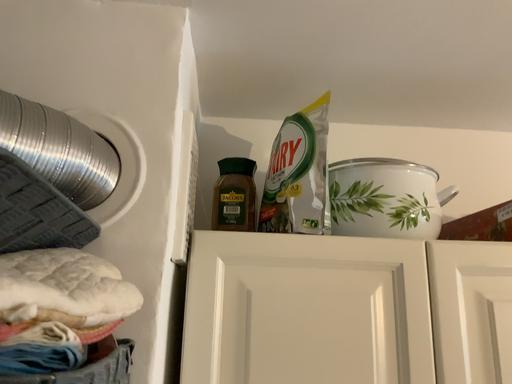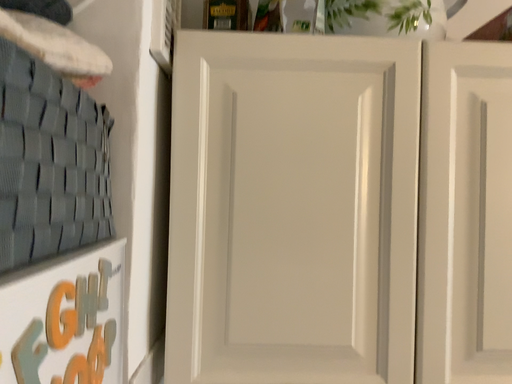
Question: Which way did the camera rotate in the video?

Choices:
 (A) rotated upward
 (B) rotated downward

Answer: (B)